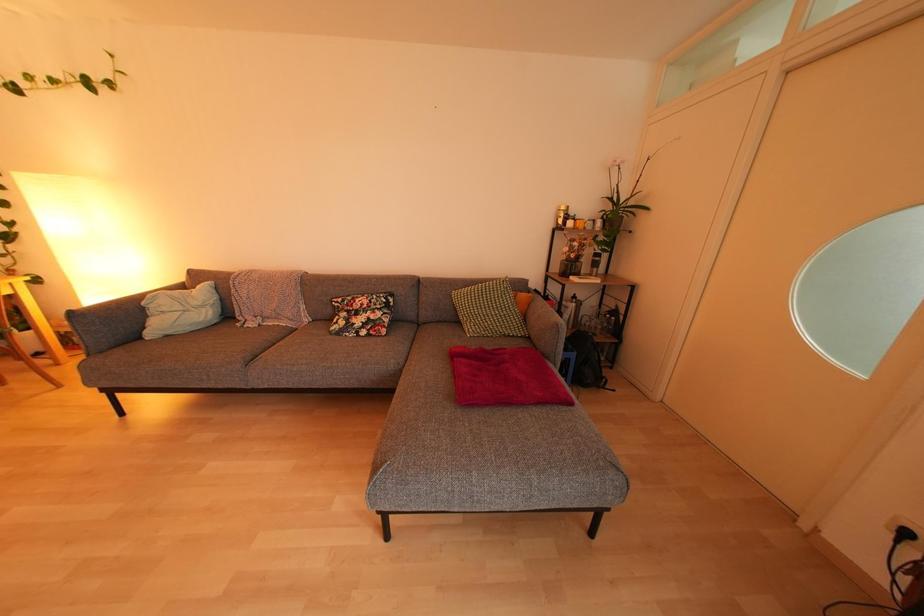
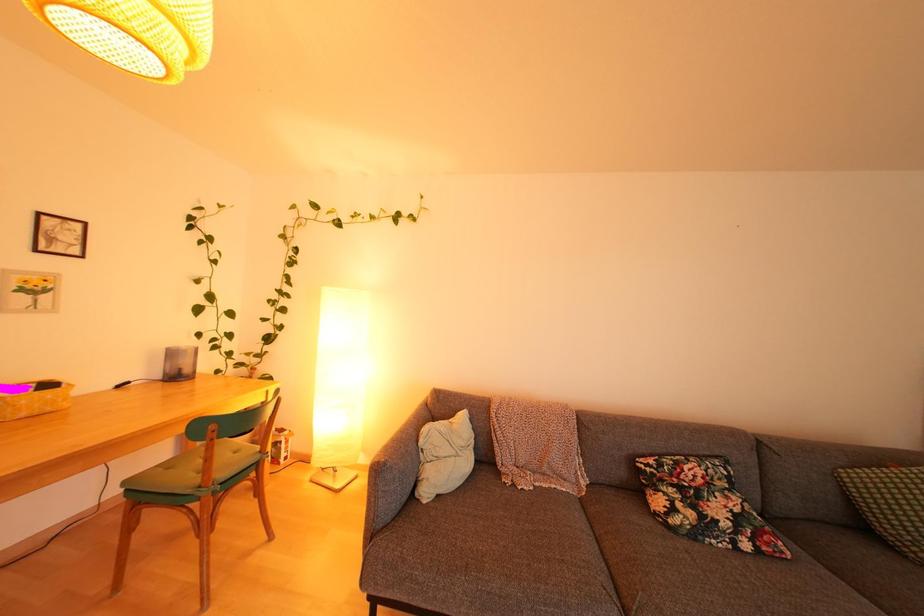
Question: Which direction would the cameraman need to move to produce the second image? Reply with the corresponding letter.

Choices:
 (A) Left
 (B) Right
 (C) Forward
 (D) Backward

Answer: (A)